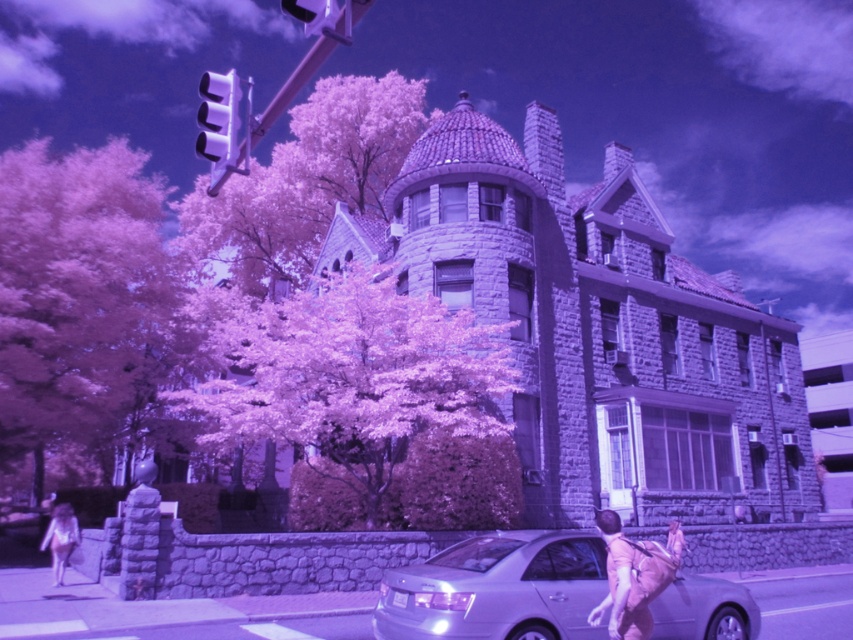
Is point (190, 196) in front of point (62, 518)?

No, it is behind (62, 518).

Can you confirm if purple leafy tree at upper center is positioned above white cotton dress at lower left?

Yes, purple leafy tree at upper center is above white cotton dress at lower left.

Who is more distant from viewer, (310, 211) or (53, 536)?

The point (310, 211) is more distant.

Find the location of `purple leafy tree at upper center`. purple leafy tree at upper center is located at coordinates pyautogui.click(x=305, y=180).

Does matte brown backpack at lower right have a greater width compared to white cotton dress at lower left?

In fact, matte brown backpack at lower right might be narrower than white cotton dress at lower left.

Is point (666, 541) positioned in front of point (61, 504)?

Yes, it is.

At what (x,y) coordinates should I click in order to perform the action: click on matte brown backpack at lower right. Please return your answer as a coordinate pair (x, y). Image resolution: width=853 pixels, height=640 pixels. Looking at the image, I should click on (633, 577).

Can you confirm if purple leafy tree at left is thinner than satin silver sedan at lower center?

Incorrect, purple leafy tree at left's width is not less than satin silver sedan at lower center's.

Is point (35, 154) positioned behind point (531, 600)?

Yes.

Image resolution: width=853 pixels, height=640 pixels. In order to click on purple leafy tree at left in this screenshot , I will do `click(76, 296)`.